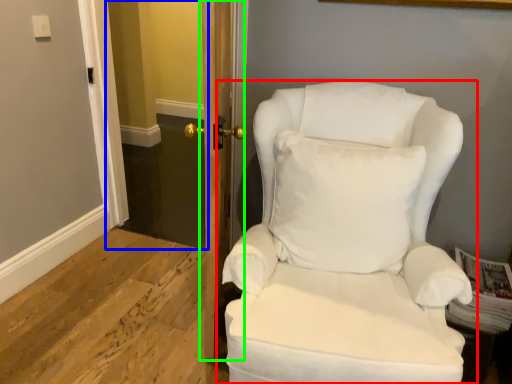
Question: Which is nearer to the chair (highlighted by a red box)? glass door (highlighted by a blue box) or door (highlighted by a green box).

Choices:
 (A) glass door
 (B) door

Answer: (B)